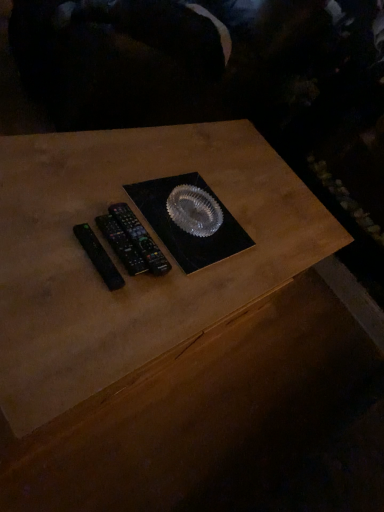
Identify the location of vacant area on the back side of black plastic remote at left, the second control from the back. (160, 214).